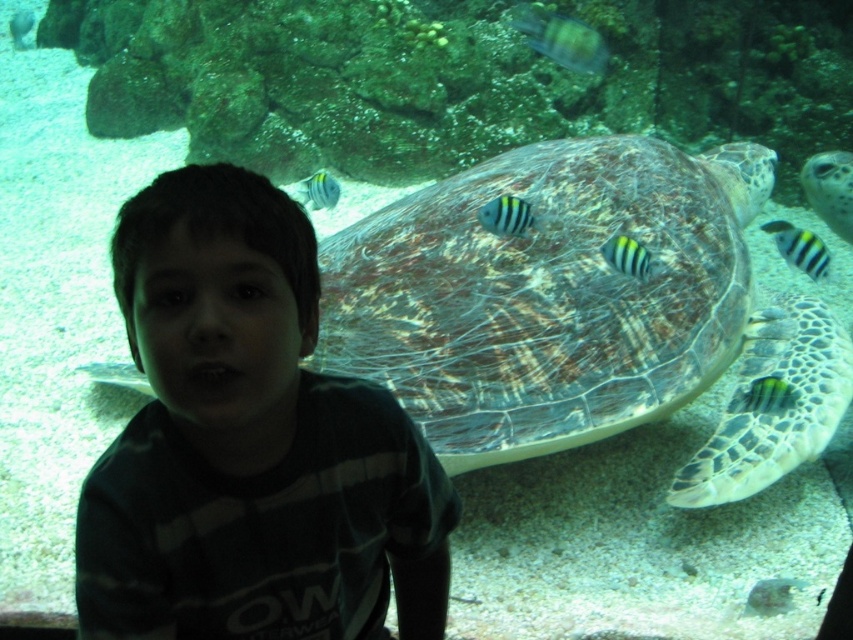
Is striped fabric fish at center behind smooth greenish-blue fish at upper center?

No, striped fabric fish at center is closer to the viewer.

Is striped fabric fish at center thinner than smooth greenish-blue fish at upper center?

Yes, striped fabric fish at center is thinner than smooth greenish-blue fish at upper center.

Between point (619, 243) and point (25, 26), which one is positioned in front?

Positioned in front is point (619, 243).

Locate an element on the screen. The height and width of the screenshot is (640, 853). striped fabric fish at center is located at coordinates (625, 256).

Consider the image. Is leathery green turtle at center above blue striped fish at upper center?

No.

Between leathery green turtle at center and blue striped fish at upper center, which one is positioned higher?

Positioned higher is blue striped fish at upper center.

Consider the image. Measure the distance between point (399, 230) and camera.

They are 1.95 meters apart.

Find the location of a particular element. The image size is (853, 640). leathery green turtle at center is located at coordinates point(583,310).

Can you confirm if striped matte fish at center is shorter than blue striped fish at upper center?

Yes.

Does striped matte fish at center have a smaller size compared to blue striped fish at upper center?

Correct, striped matte fish at center occupies less space than blue striped fish at upper center.

Between point (508, 220) and point (335, 202), which one is positioned in front?

Point (508, 220)

Identify the location of striped matte fish at center. (506, 216).